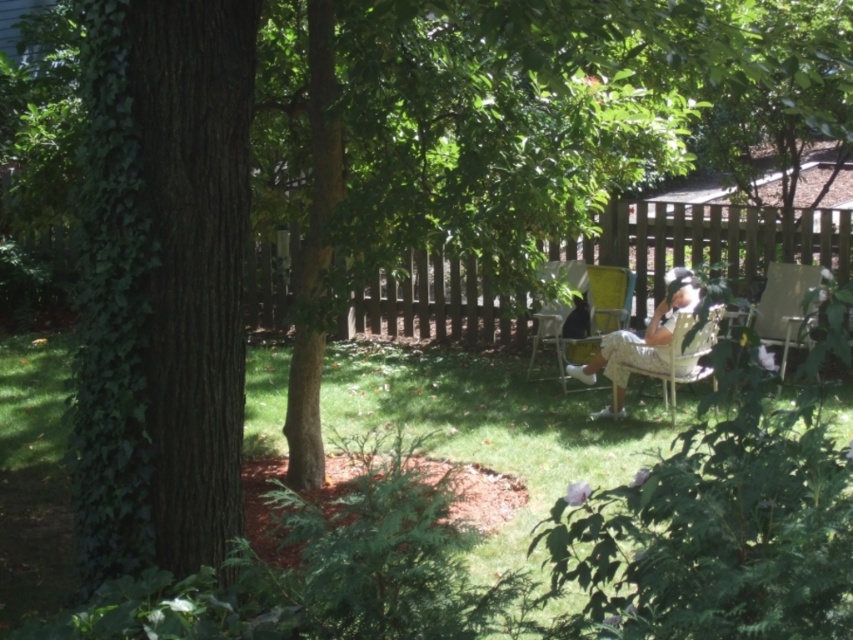
Question: Does wooden chair at right have a larger size compared to matte yellow chair at center right?

Choices:
 (A) yes
 (B) no

Answer: (A)

Question: Which point appears farthest from the camera in this image?

Choices:
 (A) (549, 310)
 (B) (421, 326)
 (C) (651, 321)
 (D) (206, 497)

Answer: (B)

Question: Which point is closer to the camera?

Choices:
 (A) (538, 330)
 (B) (598, 355)
 (C) (799, 285)

Answer: (B)

Question: Which object is positioned closest to the matte yellow chair at center right?

Choices:
 (A) brown wooden fence at center
 (B) matte yellow chair at center
 (C) green ivy-covered tree trunk at left

Answer: (B)

Question: Does green ivy-covered tree trunk at left have a greater width compared to matte yellow chair at center right?

Choices:
 (A) yes
 (B) no

Answer: (A)

Question: Is white wicker chair at right wider than matte yellow chair at center right?

Choices:
 (A) no
 (B) yes

Answer: (B)